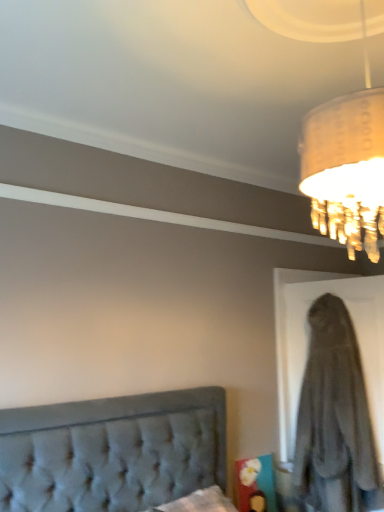
Measure the distance between dark gray fabric at lower right and camera.

dark gray fabric at lower right and camera are 2.43 meters apart from each other.

What are the coordinates of `dark gray fabric at lower right` in the screenshot? It's located at (335, 418).

The image size is (384, 512). What do you see at coordinates (335, 418) in the screenshot?
I see `dark gray fabric at lower right` at bounding box center [335, 418].

Identify the location of dark gray fabric at lower right. The width and height of the screenshot is (384, 512). (335, 418).